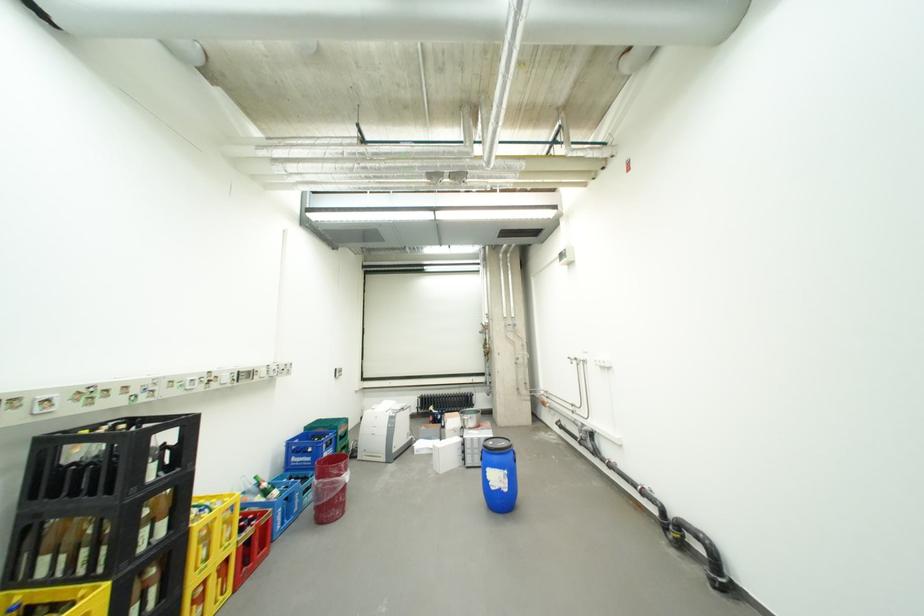
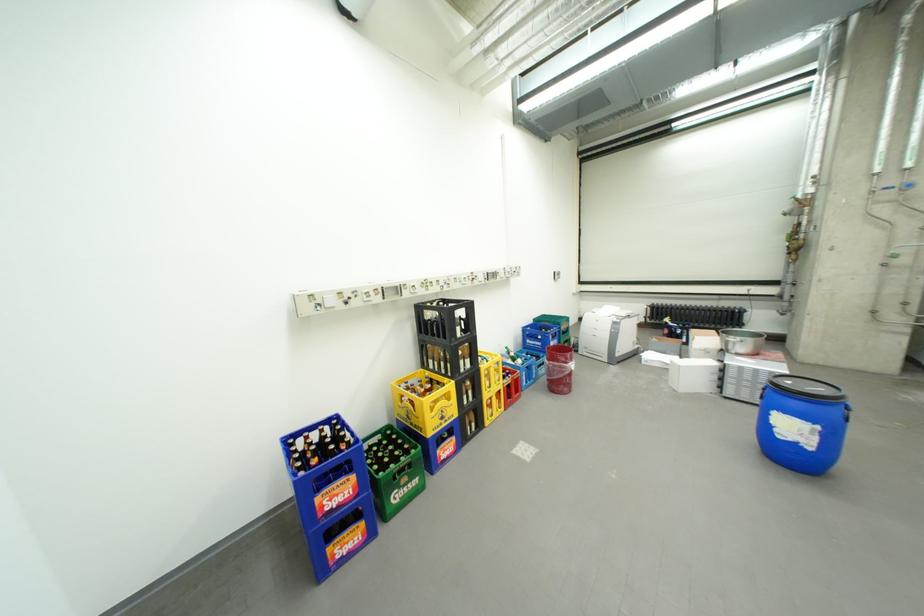
Find the pixel in the second image that matches point (405, 452) in the first image.

(627, 355)